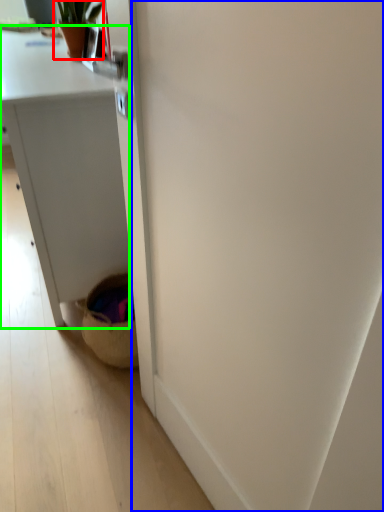
Question: Estimate the real-world distances between objects in this image. Which object is farther from houseplant (highlighted by a red box), screen door (highlighted by a blue box) or desk (highlighted by a green box)?

Choices:
 (A) screen door
 (B) desk

Answer: (A)